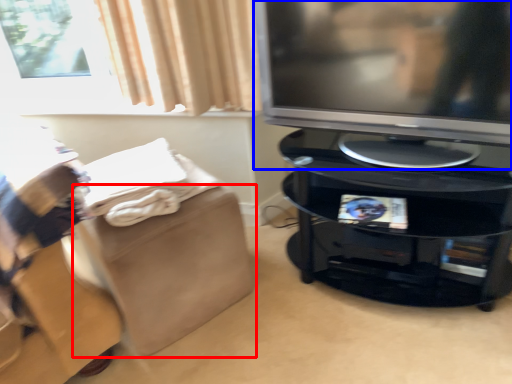
Question: Among these objects, which one is farthest to the camera, footrest (highlighted by a red box) or television (highlighted by a blue box)?

Choices:
 (A) footrest
 (B) television

Answer: (A)